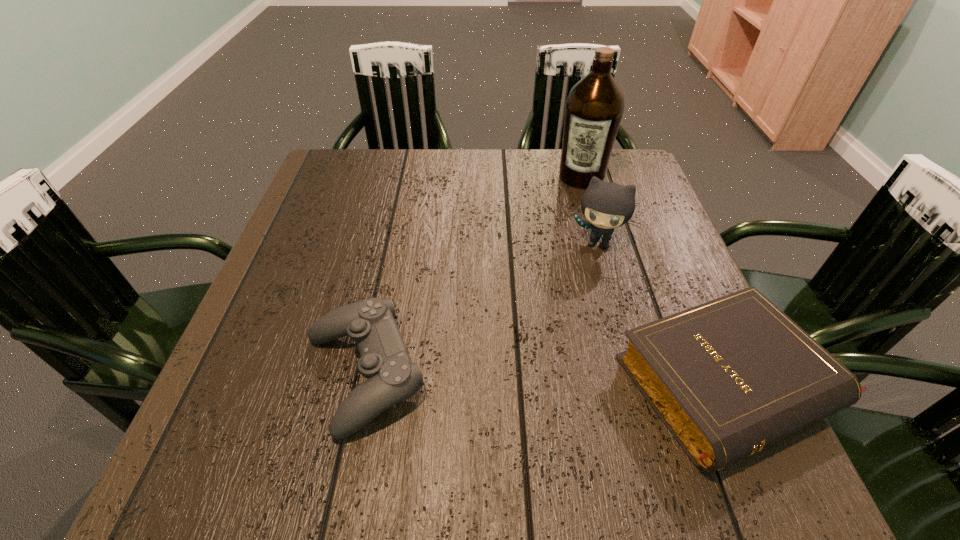
Find the location of a particular element. free point between the kitten and the Bible is located at coordinates (664, 313).

This screenshot has width=960, height=540. In order to click on free space between the second tallest object and the Bible in this screenshot , I will do `click(664, 313)`.

Where is `vacant area that lies between the control and the Bible`? vacant area that lies between the control and the Bible is located at coordinates (548, 379).

Locate an element on the screen. free space between the third shortest object and the control is located at coordinates (480, 308).

Locate an element on the screen. The height and width of the screenshot is (540, 960). vacant area between the third shortest object and the leftmost object is located at coordinates tap(480, 308).

This screenshot has height=540, width=960. Identify the location of empty location between the third shortest object and the control. (480, 308).

Find the location of `vacant area that lies between the Bible and the control`. vacant area that lies between the Bible and the control is located at coordinates (548, 379).

In order to click on free space between the leftmost object and the Bible in this screenshot , I will do `click(548, 379)`.

Image resolution: width=960 pixels, height=540 pixels. I want to click on object that is the third closest to the kitten, so click(x=391, y=376).

Identify which object is the third closest to the third nearest object. Please provide its 2D coordinates. Your answer should be formatted as a tuple, i.e. [(x, y)], where the tuple contains the x and y coordinates of a point satisfying the conditions above.

[(391, 376)]